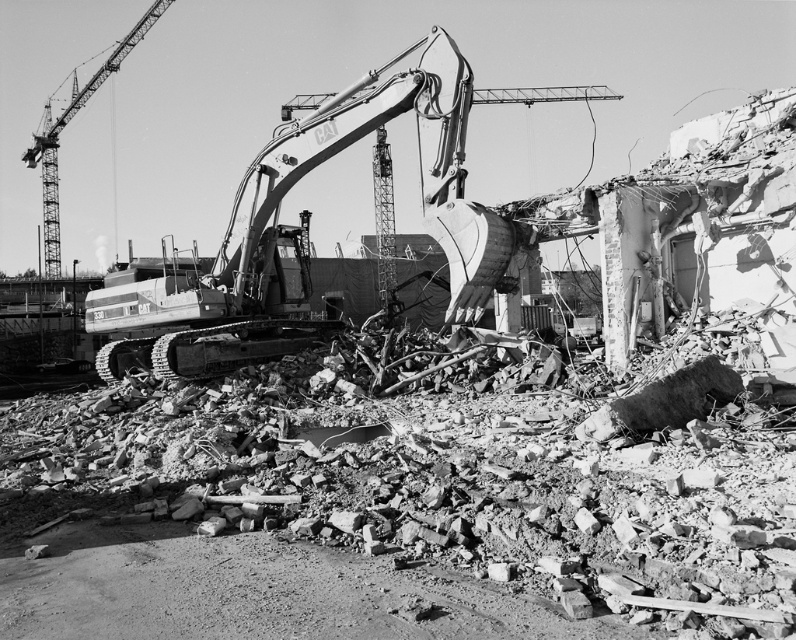
Question: Does metallic gray excavator at center have a larger size compared to metallic gray crane at upper left?

Choices:
 (A) yes
 (B) no

Answer: (B)

Question: Which point appears closest to the camera in this image?

Choices:
 (A) (53, 218)
 (B) (439, 42)

Answer: (B)

Question: Observing the image, what is the correct spatial positioning of metallic gray excavator at center in reference to metallic gray crane at upper left?

Choices:
 (A) left
 (B) right

Answer: (B)

Question: Does metallic gray excavator at center come behind metallic gray crane at upper left?

Choices:
 (A) no
 (B) yes

Answer: (A)

Question: Among these points, which one is farthest from the camera?

Choices:
 (A) (45, 218)
 (B) (463, 202)

Answer: (A)